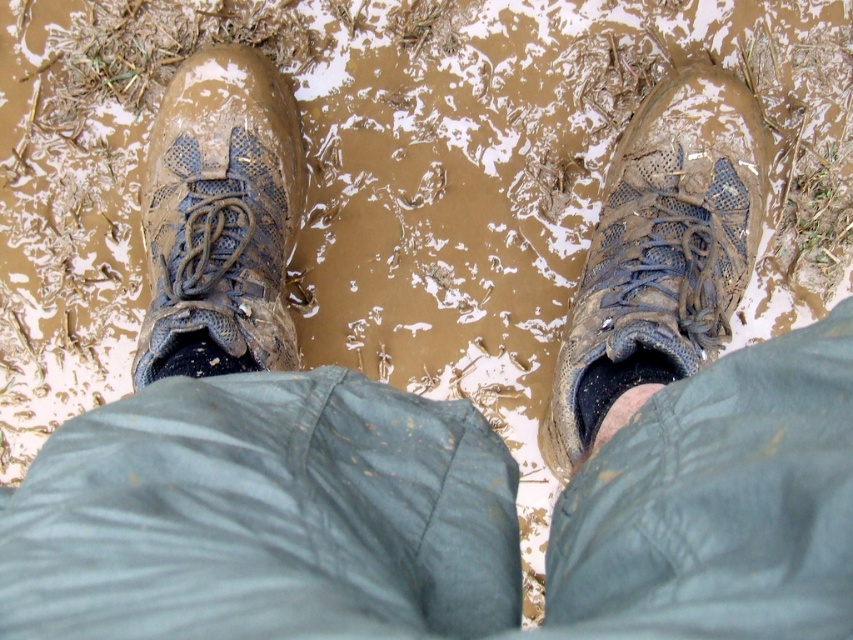
You are a hiker who wants to know which boot has a wider base to provide better stability on muddy terrain. Based on the image, which boot between the muddy mesh boot at right and the muddy textured boot at left has a wider base?

The muddy mesh boot at right has a wider base than the muddy textured boot at left, providing better stability on muddy terrain.

You are a photographer trying to capture a detailed shot of the muddy area between the two points, point (630, 195) and point (199, 154). Which point should you focus on to ensure the foreground is sharp?

Point (630, 195) is further to the camera than point (199, 154), so you should focus on point (630, 195) to ensure the foreground is sharp.

You are a photographer trying to capture the texture details of both muddy mesh boot at right and muddy textured boot at left. Since you can only focus on one boot at a time, which boot should you position your camera to the right side to capture?

To capture the muddy mesh boot at right, you should position your camera to the right side since it is located to the right of the muddy textured boot at left.